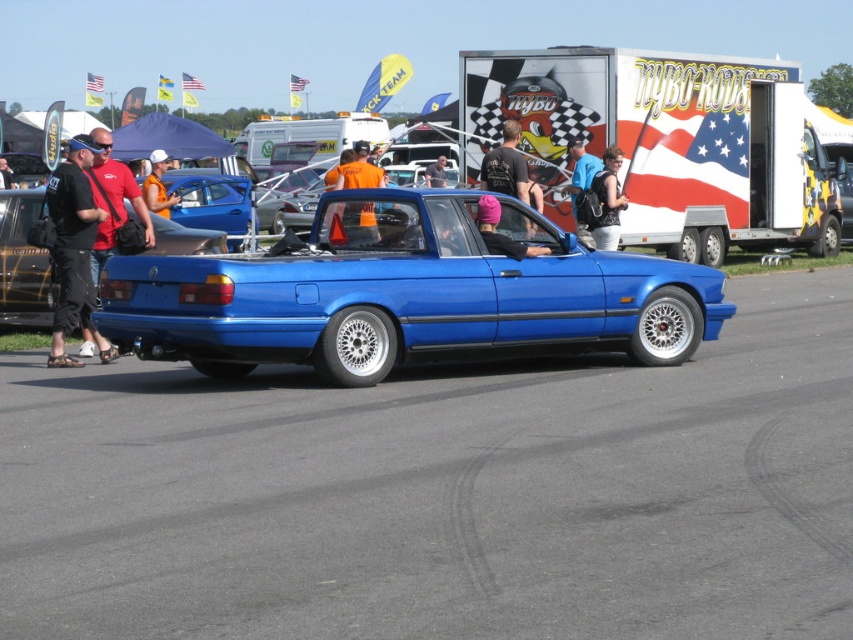
Question: Is blue fabric backpack at center bigger than matte orange shirt at center?

Choices:
 (A) no
 (B) yes

Answer: (A)

Question: Considering the real-world distances, which object is farthest from the matte black car at center?

Choices:
 (A) black t-shirt at center
 (B) orange fabric shirt at center

Answer: (B)

Question: Does pink fabric headband at center appear on the left side of matte black car at center?

Choices:
 (A) yes
 (B) no

Answer: (B)

Question: Which object appears farthest from the camera in this image?

Choices:
 (A) blue metallic pickup truck at center
 (B) matte orange shirt at center
 (C) black leather jacket at center
 (D) orange fabric shirt at center

Answer: (C)

Question: Does matte blue car at center appear over orange fabric shirt at center?

Choices:
 (A) no
 (B) yes

Answer: (B)

Question: Which object is farther from the camera taking this photo?

Choices:
 (A) matte blue car at center
 (B) matte black jacket at center

Answer: (B)